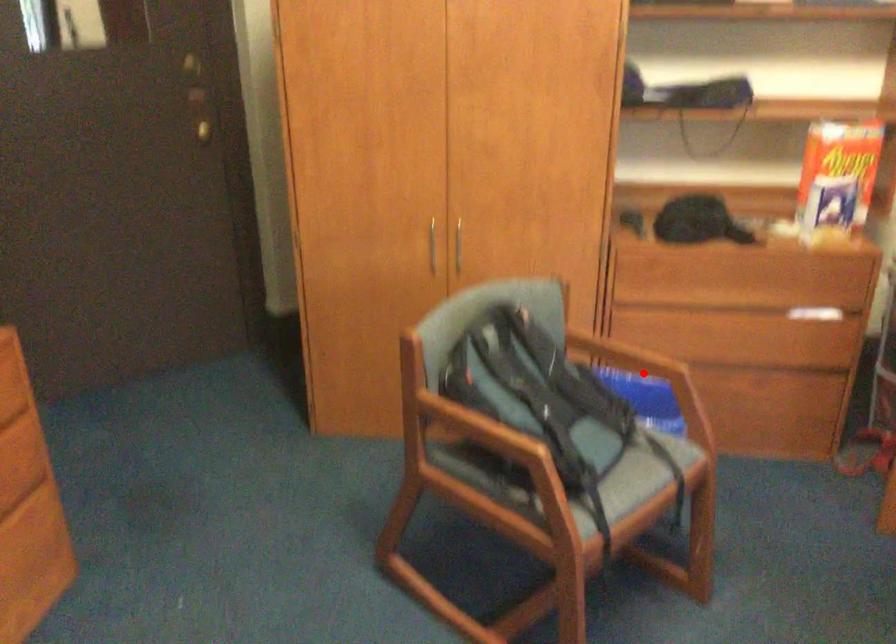
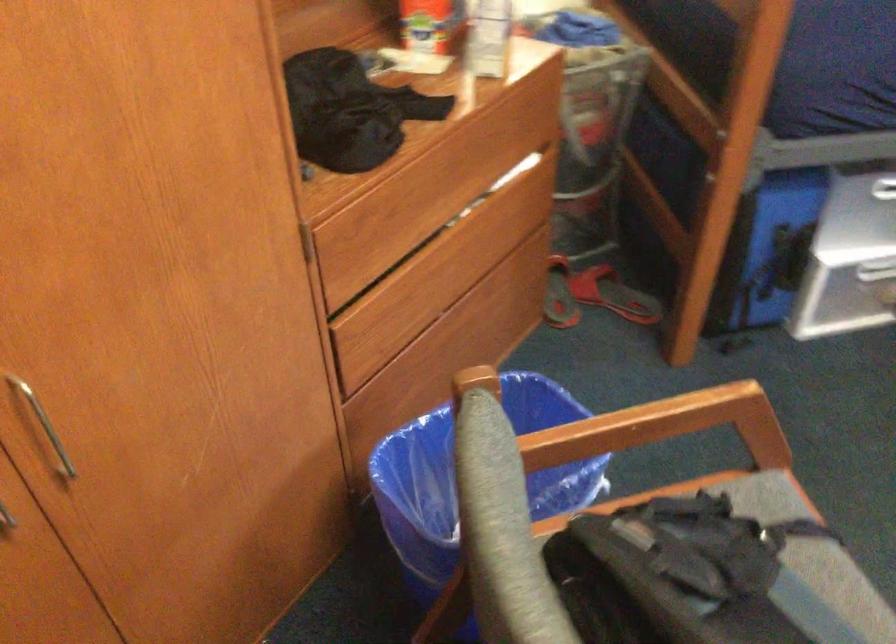
The point at the highlighted location is marked in the first image. Where is the corresponding point in the second image?

(672, 421)